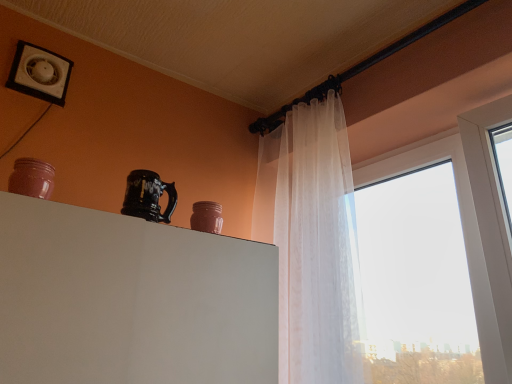
Locate an element on the screen. The height and width of the screenshot is (384, 512). glossy ceramic mug at upper center is located at coordinates (148, 196).

The height and width of the screenshot is (384, 512). In order to click on matte pink jar at upper center, which appears as the first pottery when viewed from the back in this screenshot , I will do `click(207, 217)`.

Measure the distance from matte pink jar at left, which is the 1th pottery in front-to-back order, to matte pink jar at upper center, the first pottery positioned from the bottom.

A distance of 38.77 centimeters exists between matte pink jar at left, which is the 1th pottery in front-to-back order, and matte pink jar at upper center, the first pottery positioned from the bottom.

Considering the sizes of objects matte pink jar at left, which ranks as the second pottery in back-to-front order, and matte pink jar at upper center, the first pottery positioned from the bottom, in the image provided, who is bigger, matte pink jar at left, which ranks as the second pottery in back-to-front order, or matte pink jar at upper center, the first pottery positioned from the bottom,?

matte pink jar at upper center, the first pottery positioned from the bottom, is bigger.

Which is behind, point (27, 183) or point (220, 217)?

The point (220, 217) is more distant.

Identify the location of pottery that appears above the matte pink jar at left, which is the 2th pottery in bottom-to-top order (from a real-world perspective). The width and height of the screenshot is (512, 384). (207, 217).

Can you tell me how much matte pink jar at left, which ranks as the second pottery in back-to-front order, and glossy ceramic mug at upper center differ in facing direction?

There is a 0.00134-degree angle between the facing directions of matte pink jar at left, which ranks as the second pottery in back-to-front order, and glossy ceramic mug at upper center.

You are a GUI agent. You are given a task and a screenshot of the screen. Output one action in this format:
    pyautogui.click(x=<x>, y=<y>)
    Task: Click on the pottery on the left of the glossy ceramic mug at upper center
    The width and height of the screenshot is (512, 384).
    Given the screenshot: What is the action you would take?
    pyautogui.click(x=32, y=178)

Is matte pink jar at left, the first pottery viewed from the top, closer to the viewer compared to glossy ceramic mug at upper center?

Yes, matte pink jar at left, the first pottery viewed from the top, is closer to the viewer.

Is matte pink jar at left, positioned as the second pottery in right-to-left order, to the left or to the right of glossy ceramic mug at upper center in the image?

Clearly, matte pink jar at left, positioned as the second pottery in right-to-left order, is on the left of glossy ceramic mug at upper center in the image.

From the picture: Measure the distance between matte pink jar at upper center, the first pottery positioned from the bottom, and matte pink jar at left, positioned as the second pottery in right-to-left order.

matte pink jar at upper center, the first pottery positioned from the bottom, and matte pink jar at left, positioned as the second pottery in right-to-left order, are 38.77 centimeters apart.

Are matte pink jar at upper center, the 2th pottery viewed from the top, and matte pink jar at left, which is the 2th pottery in bottom-to-top order, located far from each other?

Actually, matte pink jar at upper center, the 2th pottery viewed from the top, and matte pink jar at left, which is the 2th pottery in bottom-to-top order, are a little close together.

Is matte pink jar at upper center, the first pottery from the right, outside of matte pink jar at left, the first pottery viewed from the top?

Yes, matte pink jar at upper center, the first pottery from the right, is not within matte pink jar at left, the first pottery viewed from the top.

Is matte pink jar at upper center, the first pottery from the right, taller or shorter than matte pink jar at left, which is the 1th pottery in front-to-back order?

Considering their sizes, matte pink jar at upper center, the first pottery from the right, has less height than matte pink jar at left, which is the 1th pottery in front-to-back order.

Does matte pink jar at upper center, the first pottery positioned from the bottom, appear on the left side of glossy ceramic mug at upper center?

No.

From the picture: Which object is wider, matte pink jar at upper center, positioned as the second pottery in front-to-back order, or glossy ceramic mug at upper center?

matte pink jar at upper center, positioned as the second pottery in front-to-back order.

Locate an element on the screen. This screenshot has height=384, width=512. coffee cup that appears on the left of matte pink jar at upper center, the first pottery positioned from the bottom is located at coordinates (148, 196).

Is matte pink jar at upper center, which appears as the first pottery when viewed from the back, not near glossy ceramic mug at upper center?

matte pink jar at upper center, which appears as the first pottery when viewed from the back, is near glossy ceramic mug at upper center, not far away.

In terms of height, does white plastic vent at upper left look taller or shorter compared to glossy ceramic mug at upper center?

white plastic vent at upper left is taller than glossy ceramic mug at upper center.

Is glossy ceramic mug at upper center located within white plastic vent at upper left?

No, glossy ceramic mug at upper center is not surrounded by white plastic vent at upper left.

Can you confirm if white plastic vent at upper left is positioned to the left of glossy ceramic mug at upper center?

Yes, white plastic vent at upper left is to the left of glossy ceramic mug at upper center.

Which object is closer to the camera taking this photo, white plastic vent at upper left or glossy ceramic mug at upper center?

Positioned in front is glossy ceramic mug at upper center.

From the image's perspective, does white plastic vent at upper left appear higher than matte pink jar at upper center, which is the 2th pottery in left-to-right order?

Indeed, from the image's perspective, white plastic vent at upper left is shown above matte pink jar at upper center, which is the 2th pottery in left-to-right order.

Can you tell me how much white plastic vent at upper left and matte pink jar at upper center, the 2th pottery viewed from the top, differ in facing direction?

white plastic vent at upper left and matte pink jar at upper center, the 2th pottery viewed from the top, are facing 0.851 degrees away from each other.

Is white plastic vent at upper left to the left of matte pink jar at upper center, the 2th pottery viewed from the top, from the viewer's perspective?

Yes, white plastic vent at upper left is to the left of matte pink jar at upper center, the 2th pottery viewed from the top.

Between white plastic vent at upper left and matte pink jar at upper center, positioned as the second pottery in front-to-back order, which one has smaller width?

Thinner between the two is white plastic vent at upper left.

In the image, is glossy ceramic mug at upper center positioned in front of or behind matte pink jar at left, which ranks as the second pottery in back-to-front order?

glossy ceramic mug at upper center is behind matte pink jar at left, which ranks as the second pottery in back-to-front order.

Is glossy ceramic mug at upper center positioned far away from matte pink jar at left, the first pottery viewed from the top?

Actually, glossy ceramic mug at upper center and matte pink jar at left, the first pottery viewed from the top, are a little close together.

Consider the image. Is matte pink jar at left, positioned as the second pottery in right-to-left order, completely or partially inside glossy ceramic mug at upper center?

No, matte pink jar at left, positioned as the second pottery in right-to-left order, is not surrounded by glossy ceramic mug at upper center.

Looking at their sizes, would you say glossy ceramic mug at upper center is wider or thinner than matte pink jar at left, positioned as the second pottery in right-to-left order?

Clearly, glossy ceramic mug at upper center has more width compared to matte pink jar at left, positioned as the second pottery in right-to-left order.

Locate an element on the screen. Image resolution: width=512 pixels, height=384 pixels. pottery located above the matte pink jar at left, which is the 1th pottery in front-to-back order (from a real-world perspective) is located at coordinates (207, 217).

Locate an element on the screen. coffee cup that is on the right side of matte pink jar at left, which is the first pottery in left-to-right order is located at coordinates (148, 196).

From the picture: Which object lies nearer to the anchor point matte pink jar at upper center, which appears as the first pottery when viewed from the back, matte pink jar at left, which is the first pottery in left-to-right order, or glossy ceramic mug at upper center?

glossy ceramic mug at upper center.

When comparing their distances from matte pink jar at upper center, the 2th pottery viewed from the top, does matte pink jar at left, which is the first pottery in left-to-right order, or white plastic vent at upper left seem further?

white plastic vent at upper left is positioned further to the anchor matte pink jar at upper center, the 2th pottery viewed from the top.

Estimate the real-world distances between objects in this image. Which object is closer to glossy ceramic mug at upper center, matte pink jar at upper center, the 2th pottery viewed from the top, or matte pink jar at left, positioned as the second pottery in right-to-left order?

matte pink jar at upper center, the 2th pottery viewed from the top, is positioned closer to the anchor glossy ceramic mug at upper center.

Considering their positions, is white plastic vent at upper left positioned closer to matte pink jar at left, the first pottery viewed from the top, than glossy ceramic mug at upper center?

The object closer to matte pink jar at left, the first pottery viewed from the top, is glossy ceramic mug at upper center.

When comparing their distances from matte pink jar at upper center, the 2th pottery viewed from the top, does glossy ceramic mug at upper center or matte pink jar at left, the first pottery viewed from the top, seem further?

matte pink jar at left, the first pottery viewed from the top.

Looking at this image, when comparing their distances from matte pink jar at upper center, which is the 2th pottery in left-to-right order, does white plastic vent at upper left or matte pink jar at left, which is the 2th pottery in bottom-to-top order, seem further?

The object further to matte pink jar at upper center, which is the 2th pottery in left-to-right order, is white plastic vent at upper left.

Looking at this image, which object lies nearer to the anchor point white plastic vent at upper left, matte pink jar at left, which is the 1th pottery in front-to-back order, or matte pink jar at upper center, positioned as the second pottery in front-to-back order?

Among the two, matte pink jar at left, which is the 1th pottery in front-to-back order, is located nearer to white plastic vent at upper left.

When comparing their distances from matte pink jar at left, which is the 1th pottery in front-to-back order, does matte pink jar at upper center, positioned as the second pottery in front-to-back order, or white plastic vent at upper left seem closer?

matte pink jar at upper center, positioned as the second pottery in front-to-back order.

The width and height of the screenshot is (512, 384). Find the location of `coffee cup situated between matte pink jar at left, positioned as the second pottery in right-to-left order, and matte pink jar at upper center, which is the 2th pottery in left-to-right order, from left to right`. coffee cup situated between matte pink jar at left, positioned as the second pottery in right-to-left order, and matte pink jar at upper center, which is the 2th pottery in left-to-right order, from left to right is located at coordinates (148, 196).

Locate an element on the screen. This screenshot has height=384, width=512. coffee cup situated between white plastic vent at upper left and matte pink jar at upper center, positioned as the second pottery in front-to-back order, from left to right is located at coordinates (148, 196).

You are a GUI agent. You are given a task and a screenshot of the screen. Output one action in this format:
    pyautogui.click(x=<x>, y=<y>)
    Task: Click on the pottery between white plastic vent at upper left and matte pink jar at upper center, positioned as the second pottery in front-to-back order, in the horizontal direction
    Image resolution: width=512 pixels, height=384 pixels.
    Given the screenshot: What is the action you would take?
    pyautogui.click(x=32, y=178)

At what (x,y) coordinates should I click in order to perform the action: click on pottery between white plastic vent at upper left and glossy ceramic mug at upper center vertically. Please return your answer as a coordinate pair (x, y). The image size is (512, 384). Looking at the image, I should click on (32, 178).